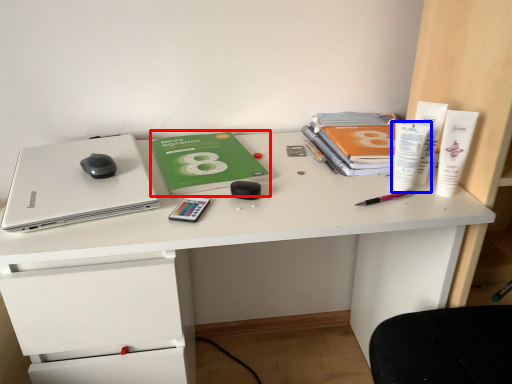
Question: Which object is closer to the camera taking this photo, paperback book (highlighted by a red box) or stationery (highlighted by a blue box)?

Choices:
 (A) paperback book
 (B) stationery

Answer: (B)